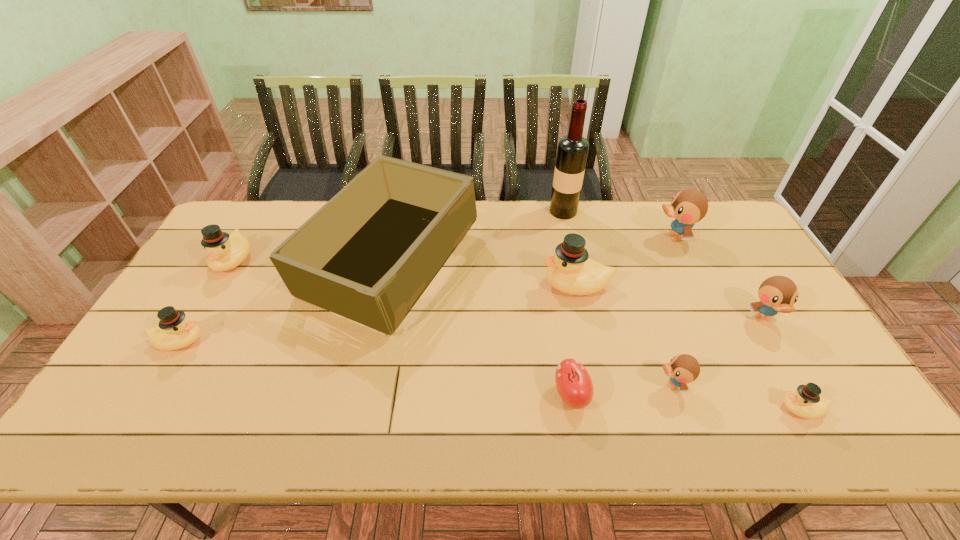
Image resolution: width=960 pixels, height=540 pixels. I want to click on free space at the far edge of the desktop, so click(x=602, y=233).

In the image, there is a desktop. What are the coordinates of `vacant space at the near edge` in the screenshot? It's located at (631, 420).

Image resolution: width=960 pixels, height=540 pixels. What are the coordinates of `free space at the left edge of the desktop` in the screenshot? It's located at (142, 364).

In the image, there is a desktop. Find the location of `blank space at the right edge`. blank space at the right edge is located at coordinates (754, 327).

You are a GUI agent. You are given a task and a screenshot of the screen. Output one action in this format:
    pyautogui.click(x=<x>, y=<y>)
    Task: Click on the free space at the far left corner of the desktop
    
    Given the screenshot: What is the action you would take?
    pyautogui.click(x=232, y=217)

The width and height of the screenshot is (960, 540). Find the location of `free space that is in between the rightmost yellow duck and the second biggest yellow duck`. free space that is in between the rightmost yellow duck and the second biggest yellow duck is located at coordinates (517, 334).

This screenshot has width=960, height=540. What are the coordinates of `free spot between the second biggest blue duck and the shortest duck` in the screenshot? It's located at (782, 364).

Where is `vacant area that lies between the fourth object from right to left and the third object from left to right`? Image resolution: width=960 pixels, height=540 pixels. vacant area that lies between the fourth object from right to left and the third object from left to right is located at coordinates (531, 325).

This screenshot has width=960, height=540. In order to click on vacant region between the second biggest yellow duck and the nearest yellow duck in this screenshot , I will do point(517,334).

Where is `unoccupied position between the leftmost blue duck and the apple`? unoccupied position between the leftmost blue duck and the apple is located at coordinates (621, 390).